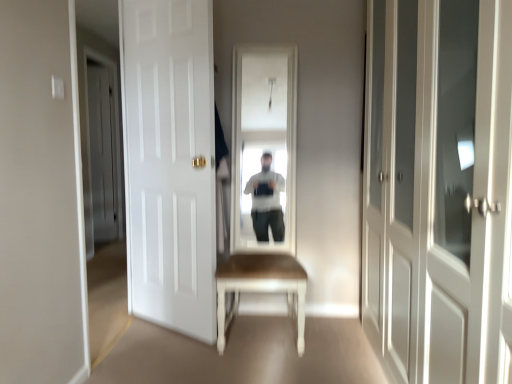
Where is `vacant space in front of white matte door at center, which is counted as the 2th door, starting from the back`? vacant space in front of white matte door at center, which is counted as the 2th door, starting from the back is located at coordinates (166, 352).